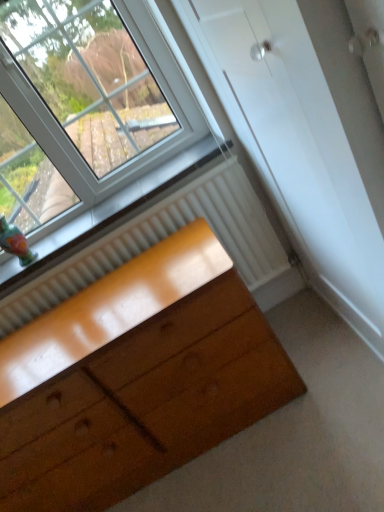
What do you see at coordinates (135, 378) in the screenshot? This screenshot has height=512, width=384. I see `glossy wood chest of drawers at lower left` at bounding box center [135, 378].

I want to click on glossy wood chest of drawers at lower left, so [x=135, y=378].

The height and width of the screenshot is (512, 384). I want to click on glossy wood chest of drawers at lower left, so click(x=135, y=378).